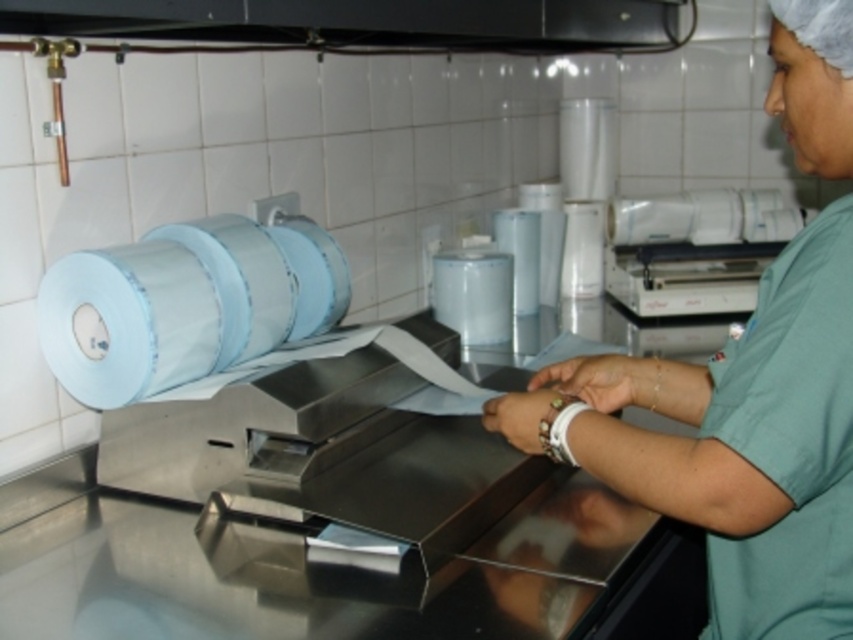
Question: Estimate the real-world distances between objects in this image. Which object is farther from the green fabric at center?

Choices:
 (A) blue glossy toilet paper at left
 (B) metallic stainless steel counter top at center
 (C) white glossy toilet paper at upper right

Answer: (C)

Question: Is metallic stainless steel counter top at center bigger than green fabric at center?

Choices:
 (A) no
 (B) yes

Answer: (B)

Question: Does blue glossy toilet paper at left appear over white glossy toilet paper at upper right?

Choices:
 (A) no
 (B) yes

Answer: (A)

Question: Which of these objects is positioned closest to the metallic stainless steel counter top at center?

Choices:
 (A) green fabric at center
 (B) blue glossy toilet paper at left

Answer: (A)

Question: From the image, what is the correct spatial relationship of green fabric at center in relation to blue glossy toilet paper at left?

Choices:
 (A) below
 (B) above

Answer: (A)

Question: Among these objects, which one is farthest from the camera?

Choices:
 (A) white glossy toilet paper at upper right
 (B) blue glossy toilet paper at left
 (C) green fabric at center
 (D) metallic stainless steel counter top at center

Answer: (A)